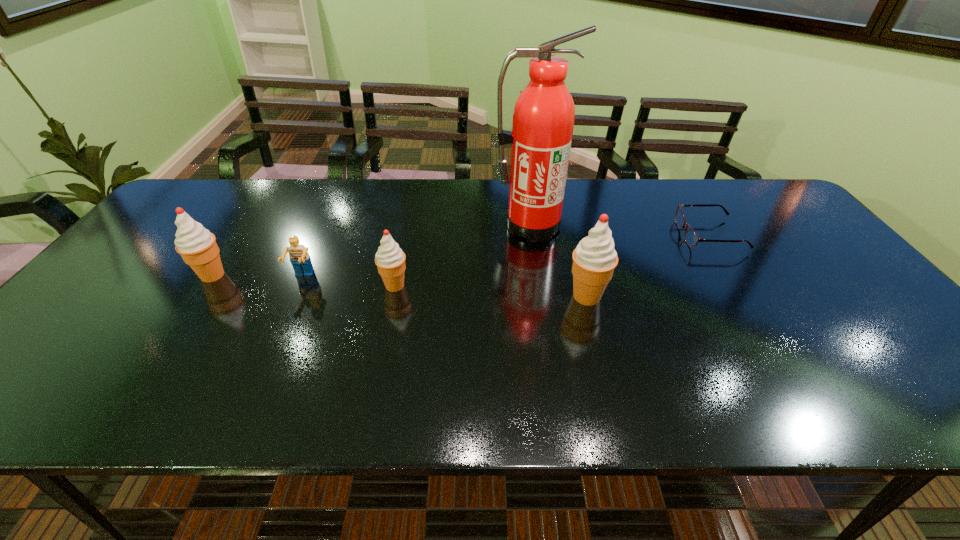
Please point a vacant point for placing a icecream on the right. Please provide its 2D coordinates. Your answer should be formatted as a tuple, i.e. [(x, y)], where the tuple contains the x and y coordinates of a point satisfying the conditions above.

[(789, 308)]